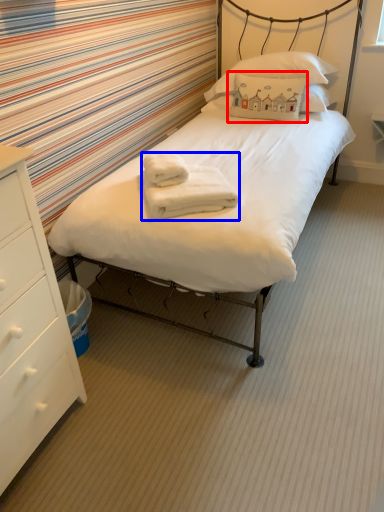
Question: Which of the following is the farthest to the observer, pillow (highlighted by a red box) or bath towel (highlighted by a blue box)?

Choices:
 (A) pillow
 (B) bath towel

Answer: (A)